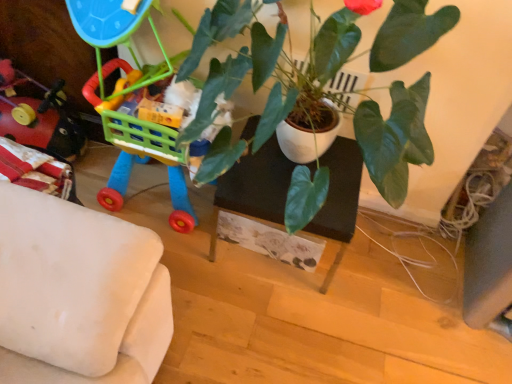
This screenshot has height=384, width=512. I want to click on green glossy plant at center, so click(394, 138).

Looking at this image, measure the distance between plastic toy cart at left, the 1th toy from the right, and camera.

4.24 feet.

Describe the element at coordinates (152, 132) in the screenshot. I see `plastic toy cart at left, which is the second toy in left-to-right order` at that location.

Where is `green glossy plant at center`? The width and height of the screenshot is (512, 384). green glossy plant at center is located at coordinates (x=394, y=138).

Can you confirm if rubberized plastic toy at left, the second toy viewed from the right, is taller than plastic toy cart at left, the 1th toy from the right?

No.

Is point (47, 119) more distant than point (102, 114)?

Yes, it is.

Between rubberized plastic toy at left, the second toy viewed from the right, and plastic toy cart at left, the 1th toy from the right, which one has smaller width?

Thinner between the two is rubberized plastic toy at left, the second toy viewed from the right.

Considering the relative positions of green glossy plant at center and plastic toy cart at left, the 1th toy from the right, in the image provided, is green glossy plant at center to the right of plastic toy cart at left, the 1th toy from the right, from the viewer's perspective?

Yes.

Considering the sizes of objects green glossy plant at center and plastic toy cart at left, the 1th toy from the right, in the image provided, who is wider, green glossy plant at center or plastic toy cart at left, the 1th toy from the right,?

Wider between the two is plastic toy cart at left, the 1th toy from the right.

Is the surface of green glossy plant at center in direct contact with plastic toy cart at left, the 1th toy from the right?

green glossy plant at center and plastic toy cart at left, the 1th toy from the right, are not in contact.

Image resolution: width=512 pixels, height=384 pixels. Identify the location of the 1st toy counting from the left of the green glossy plant at center. (152, 132).

Between green glossy plant at center and rubberized plastic toy at left, the second toy viewed from the right, which one has less height?

rubberized plastic toy at left, the second toy viewed from the right.

Considering the sizes of objects green glossy plant at center and rubberized plastic toy at left, the second toy viewed from the right, in the image provided, who is wider, green glossy plant at center or rubberized plastic toy at left, the second toy viewed from the right,?

green glossy plant at center.

Is green glossy plant at center far from rubberized plastic toy at left, the second toy viewed from the right?

No, green glossy plant at center is in close proximity to rubberized plastic toy at left, the second toy viewed from the right.

Between green glossy plant at center and rubberized plastic toy at left, which appears as the first toy when viewed from the left, which one has smaller size?

rubberized plastic toy at left, which appears as the first toy when viewed from the left.

Based on their sizes in the image, would you say black matte table at center is bigger or smaller than plastic toy cart at left, which is the second toy in left-to-right order?

In the image, black matte table at center appears to be smaller than plastic toy cart at left, which is the second toy in left-to-right order.

Considering the relative positions of black matte table at center and plastic toy cart at left, the 1th toy from the right, in the image provided, is black matte table at center to the left of plastic toy cart at left, the 1th toy from the right, from the viewer's perspective?

No, black matte table at center is not to the left of plastic toy cart at left, the 1th toy from the right.

Where is `toy located above the black matte table at center (from a real-world perspective)`? toy located above the black matte table at center (from a real-world perspective) is located at coordinates (152, 132).

At what (x,y) coordinates should I click in order to perform the action: click on table below the green glossy plant at center (from the image's perspective). Please return your answer as a coordinate pair (x, y). Looking at the image, I should click on (340, 200).

Is black matte table at center far from green glossy plant at center?

No, there isn't a large distance between black matte table at center and green glossy plant at center.

Would you say black matte table at center contains green glossy plant at center?

No, green glossy plant at center is located outside of black matte table at center.

What's the angular difference between black matte table at center and green glossy plant at center's facing directions?

The facing directions of black matte table at center and green glossy plant at center are 0.000136 degrees apart.

From their relative heights in the image, would you say plastic toy cart at left, the 1th toy from the right, is taller or shorter than green glossy plant at center?

plastic toy cart at left, the 1th toy from the right, is taller than green glossy plant at center.

Consider the image. Can you confirm if plastic toy cart at left, the 1th toy from the right, is wider than green glossy plant at center?

Correct, the width of plastic toy cart at left, the 1th toy from the right, exceeds that of green glossy plant at center.

Is plastic toy cart at left, which is the second toy in left-to-right order, outside of green glossy plant at center?

plastic toy cart at left, which is the second toy in left-to-right order, is positioned outside green glossy plant at center.

From the picture: Which is behind, plastic toy cart at left, the 1th toy from the right, or green glossy plant at center?

plastic toy cart at left, the 1th toy from the right, is further away from the camera.

In terms of width, does black matte table at center look wider or thinner when compared to rubberized plastic toy at left, which appears as the first toy when viewed from the left?

black matte table at center is wider than rubberized plastic toy at left, which appears as the first toy when viewed from the left.

Considering the sizes of objects black matte table at center and rubberized plastic toy at left, the second toy viewed from the right, in the image provided, who is shorter, black matte table at center or rubberized plastic toy at left, the second toy viewed from the right,?

rubberized plastic toy at left, the second toy viewed from the right, is shorter.

Is black matte table at center inside the boundaries of rubberized plastic toy at left, the second toy viewed from the right, or outside?

black matte table at center is outside rubberized plastic toy at left, the second toy viewed from the right.

Is point (271, 162) positioned before point (29, 132)?

Yes, point (271, 162) is in front of point (29, 132).

The image size is (512, 384). I want to click on toy above the rubberized plastic toy at left, the second toy viewed from the right (from a real-world perspective), so pos(152,132).

From a real-world perspective, starting from the green glossy plant at center, which toy is the 1st one below it? Please provide its 2D coordinates.

[(152, 132)]

Looking at the image, which one is located closer to rubberized plastic toy at left, the second toy viewed from the right, plastic toy cart at left, the 1th toy from the right, or black matte table at center?

plastic toy cart at left, the 1th toy from the right, is closer to rubberized plastic toy at left, the second toy viewed from the right.

Looking at the image, which one is located further to black matte table at center, rubberized plastic toy at left, which appears as the first toy when viewed from the left, or plastic toy cart at left, the 1th toy from the right?

Among the two, rubberized plastic toy at left, which appears as the first toy when viewed from the left, is located further to black matte table at center.

Looking at this image, when comparing their distances from plastic toy cart at left, the 1th toy from the right, does green glossy plant at center or black matte table at center seem closer?

black matte table at center lies closer to plastic toy cart at left, the 1th toy from the right, than the other object.

From the image, which object appears to be farther from rubberized plastic toy at left, which appears as the first toy when viewed from the left, black matte table at center or green glossy plant at center?

green glossy plant at center lies further to rubberized plastic toy at left, which appears as the first toy when viewed from the left, than the other object.

Estimate the real-world distances between objects in this image. Which object is closer to plastic toy cart at left, the 1th toy from the right, black matte table at center or rubberized plastic toy at left, the second toy viewed from the right?

black matte table at center lies closer to plastic toy cart at left, the 1th toy from the right, than the other object.

Considering their positions, is rubberized plastic toy at left, the second toy viewed from the right, positioned further to green glossy plant at center than black matte table at center?

The object further to green glossy plant at center is rubberized plastic toy at left, the second toy viewed from the right.

When comparing their distances from black matte table at center, does plastic toy cart at left, the 1th toy from the right, or rubberized plastic toy at left, the second toy viewed from the right, seem closer?

The object closer to black matte table at center is plastic toy cart at left, the 1th toy from the right.

Looking at the image, which one is located closer to rubberized plastic toy at left, the second toy viewed from the right, green glossy plant at center or plastic toy cart at left, the 1th toy from the right?

The object closer to rubberized plastic toy at left, the second toy viewed from the right, is plastic toy cart at left, the 1th toy from the right.

You are a GUI agent. You are given a task and a screenshot of the screen. Output one action in this format:
    pyautogui.click(x=<x>, y=<y>)
    Task: Click on the toy between rubberized plastic toy at left, the second toy viewed from the right, and green glossy plant at center, in the horizontal direction
    The width and height of the screenshot is (512, 384).
    Given the screenshot: What is the action you would take?
    pyautogui.click(x=152, y=132)

Where is `table situated between plastic toy cart at left, the 1th toy from the right, and green glossy plant at center from left to right`? This screenshot has width=512, height=384. table situated between plastic toy cart at left, the 1th toy from the right, and green glossy plant at center from left to right is located at coordinates (340, 200).

I want to click on table between rubberized plastic toy at left, the second toy viewed from the right, and green glossy plant at center from left to right, so click(340, 200).

This screenshot has height=384, width=512. I want to click on toy situated between rubberized plastic toy at left, which appears as the first toy when viewed from the left, and black matte table at center from left to right, so click(x=152, y=132).